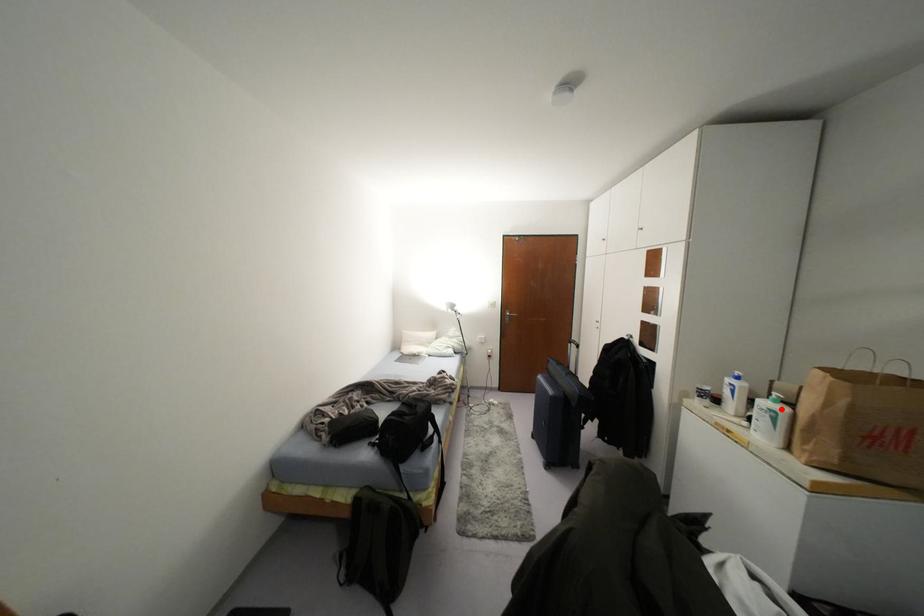
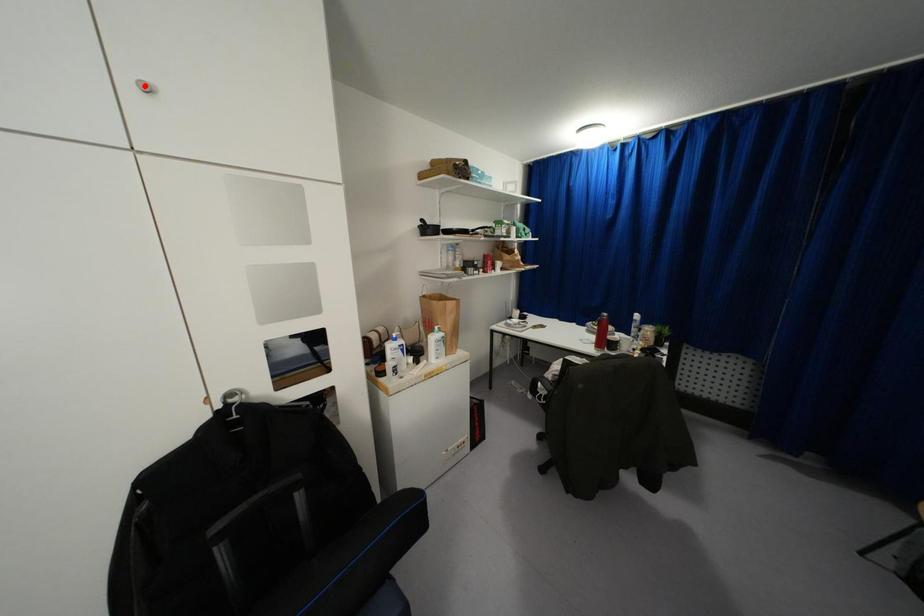
I am providing you with two images of the same scene from different viewpoints. A red point is marked on the first image and another point is marked on the second image. Does the point marked in image1 correspond to the same location as the one in image2?

No